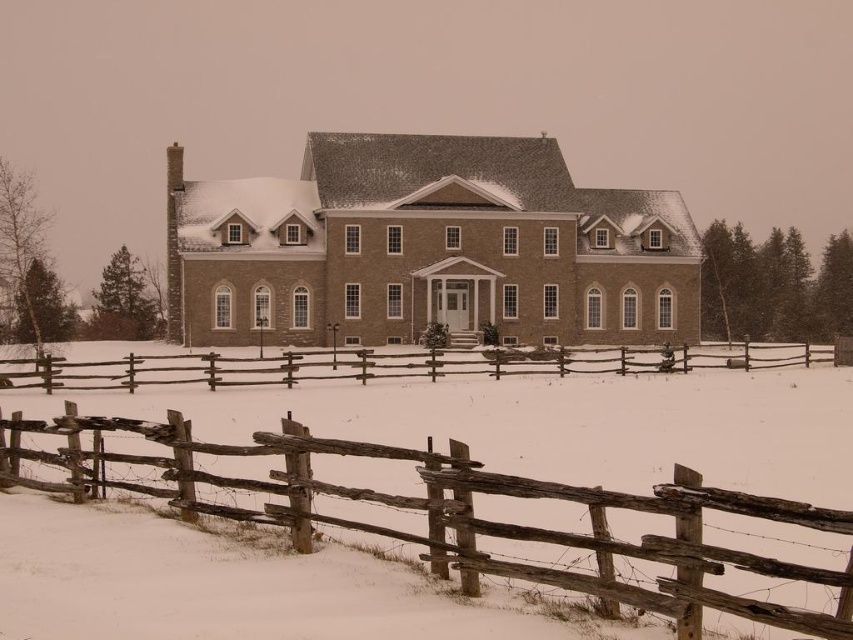
You are standing in front of the building and want to walk to the weathered wood fence at lower center. Which direction should you walk to reach it without crossing the weathered wood fence at center?

The weathered wood fence at lower center is closer to you than the weathered wood fence at center since it occupies less space. Walk towards the lower center direction to reach it without crossing the other fence.

You are standing in front of the two story brick building and want to walk to the weathered wood fence at lower center. Which direction should you walk relative to the weathered wood fence at center?

The weathered wood fence at lower center is positioned under the weathered wood fence at center, so you should walk downward towards the weathered wood fence at lower center.

You are standing at the entrance of the two story brick building and want to see which part of the weathered wood fence at lower center and the weathered wood fence at center is closer to you. Which one is nearer?

The weathered wood fence at lower center is closer to you because it is positioned in front of the weathered wood fence at center.